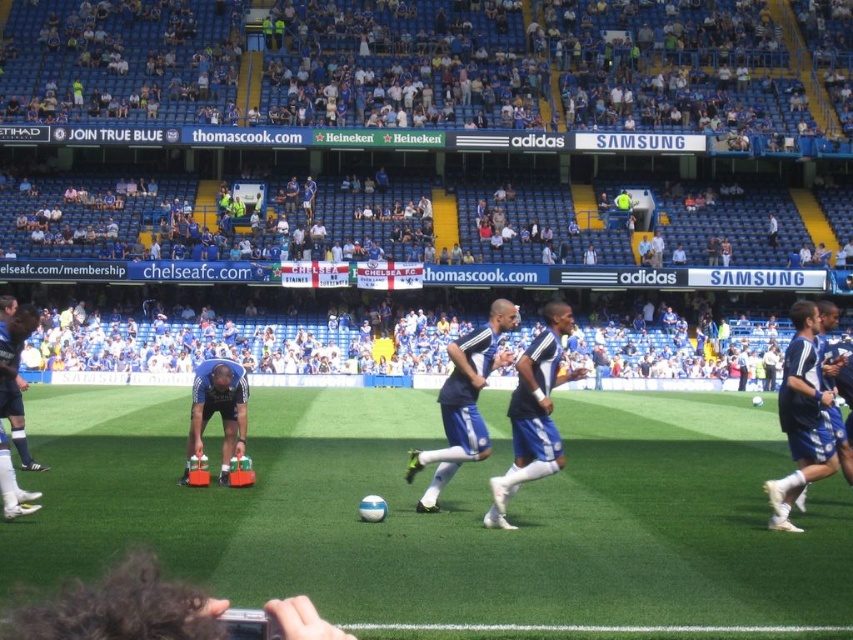
In the scene shown: You are a soccer player preparing for the match and notice the white synthetic turf at center and the blue fabric shorts at center. Which object is located lower in the image?

The white synthetic turf at center is located below the blue fabric shorts at center, so the white synthetic turf at center is lower in the image.

You are a soccer player standing at the edge of the field. You see the white synthetic turf at center and the blue fabric shorts at center. Which object is closer to you?

The white synthetic turf at center is closer to you because it is in front of the blue fabric shorts at center.